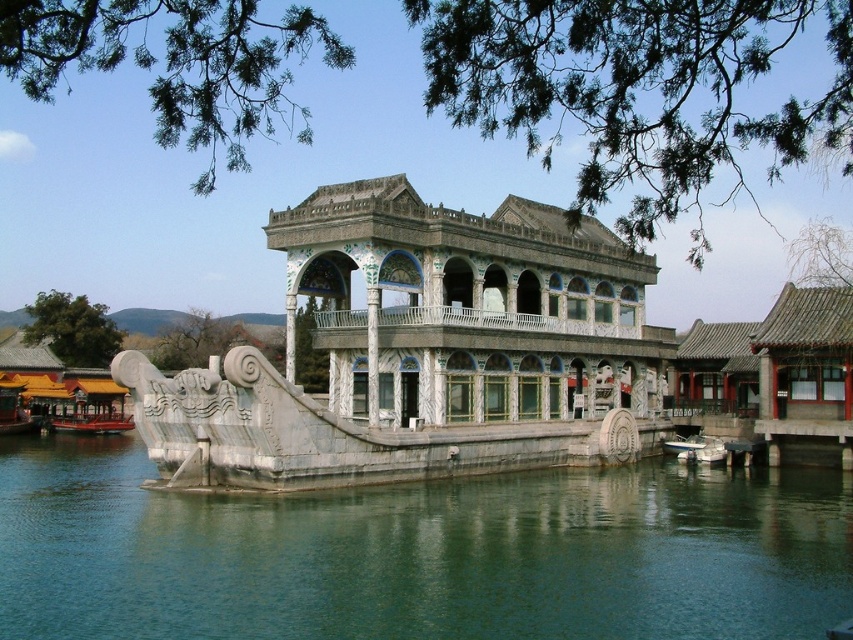
Question: Estimate the real-world distances between objects in this image. Which object is closer to the shiny red boat at lower left?

Choices:
 (A) white marble palace at center
 (B) green stone water at center

Answer: (A)

Question: Does white marble palace at center appear under shiny red boat at lower left?

Choices:
 (A) yes
 (B) no

Answer: (B)

Question: Does green stone water at center come behind shiny red boat at lower left?

Choices:
 (A) yes
 (B) no

Answer: (B)

Question: Which point is closer to the camera taking this photo?

Choices:
 (A) (550, 502)
 (B) (323, 340)

Answer: (A)

Question: From the image, what is the correct spatial relationship of white marble palace at center in relation to shiny red boat at lower left?

Choices:
 (A) left
 (B) right

Answer: (B)

Question: Estimate the real-world distances between objects in this image. Which object is closer to the shiny red boat at lower left?

Choices:
 (A) green stone water at center
 (B) white marble palace at center

Answer: (B)